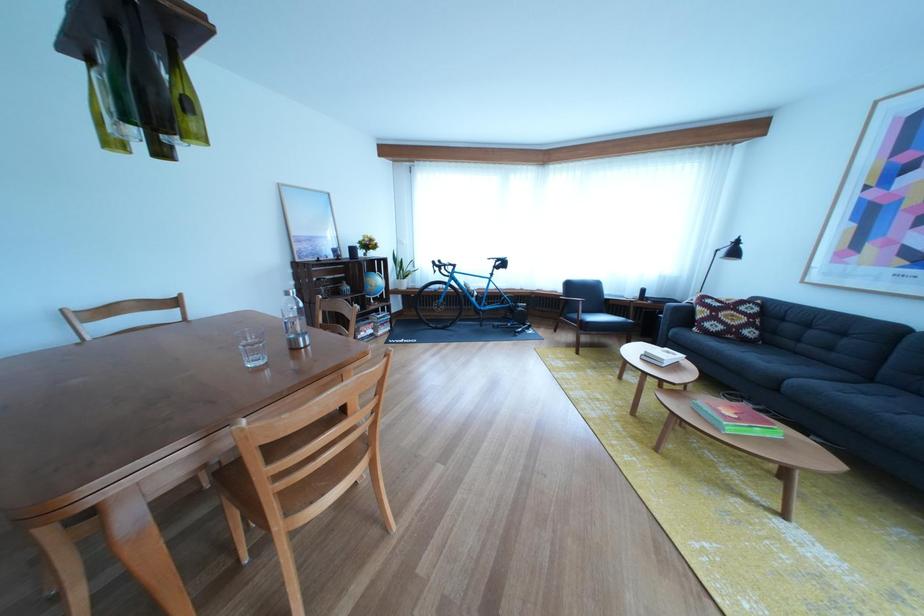
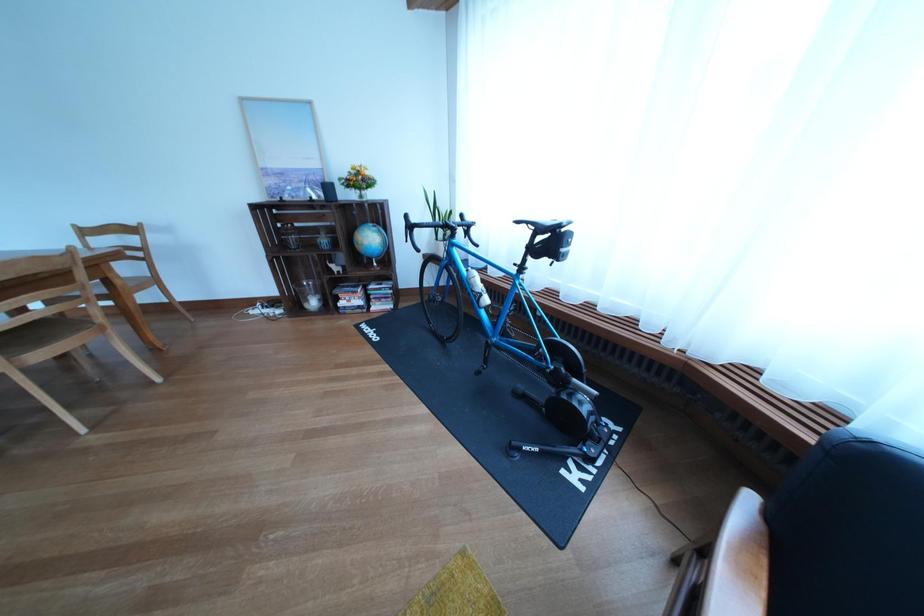
Find the pixel in the second image that matches point 471,291 in the first image.

(470, 277)